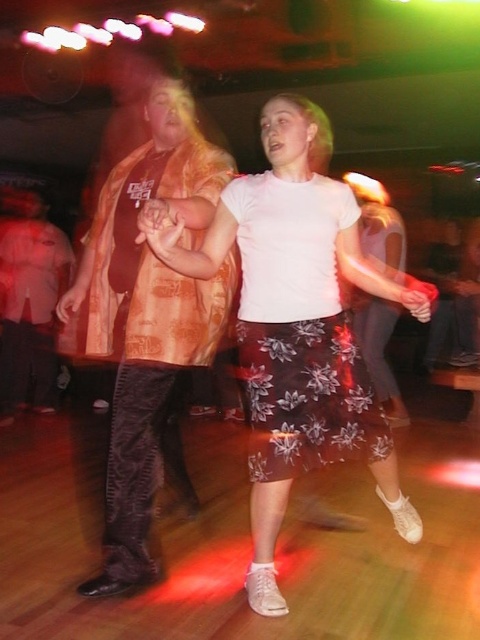
Does white matte skirt at center have a greater height compared to brown floral skirt at center?

Yes, white matte skirt at center is taller than brown floral skirt at center.

Which is below, white matte skirt at center or brown floral skirt at center?

white matte skirt at center

Image resolution: width=480 pixels, height=640 pixels. What are the coordinates of `white matte skirt at center` in the screenshot? It's located at (296, 323).

Can you confirm if white matte skirt at center is bigger than orange patterned shirt at left?

No, white matte skirt at center is not bigger than orange patterned shirt at left.

Which of these two, white matte skirt at center or orange patterned shirt at left, stands taller?

With more height is orange patterned shirt at left.

Is point (345, 420) less distant than point (147, 268)?

Yes, it is in front of point (147, 268).

The width and height of the screenshot is (480, 640). I want to click on white matte skirt at center, so click(x=296, y=323).

Can you confirm if orange patterned shirt at left is smaller than matte orange shirt at left?

Yes.

Can you confirm if orange patterned shirt at left is thinner than matte orange shirt at left?

Yes, orange patterned shirt at left is thinner than matte orange shirt at left.

Is point (134, 301) positioned after point (38, 202)?

No, (134, 301) is closer to viewer.

I want to click on orange patterned shirt at left, so click(149, 321).